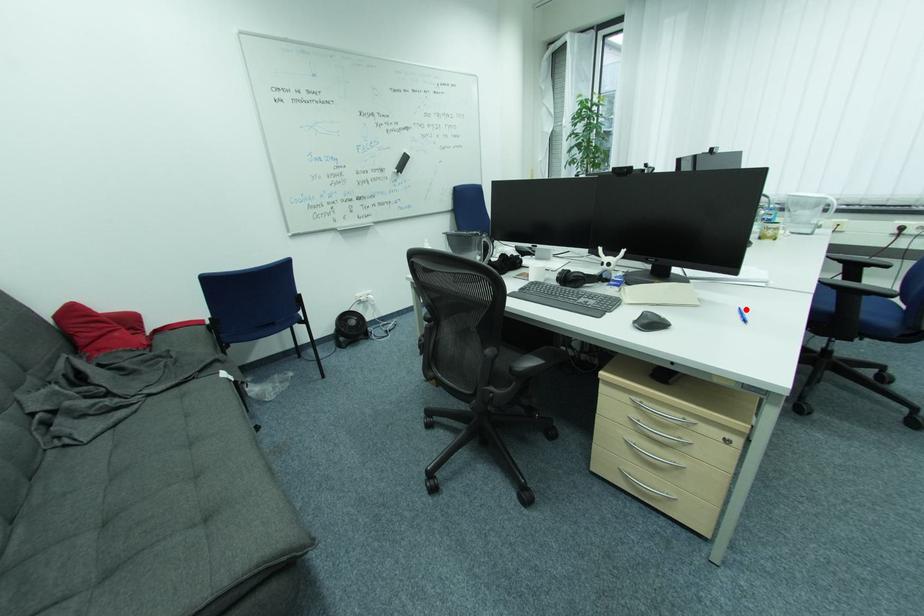
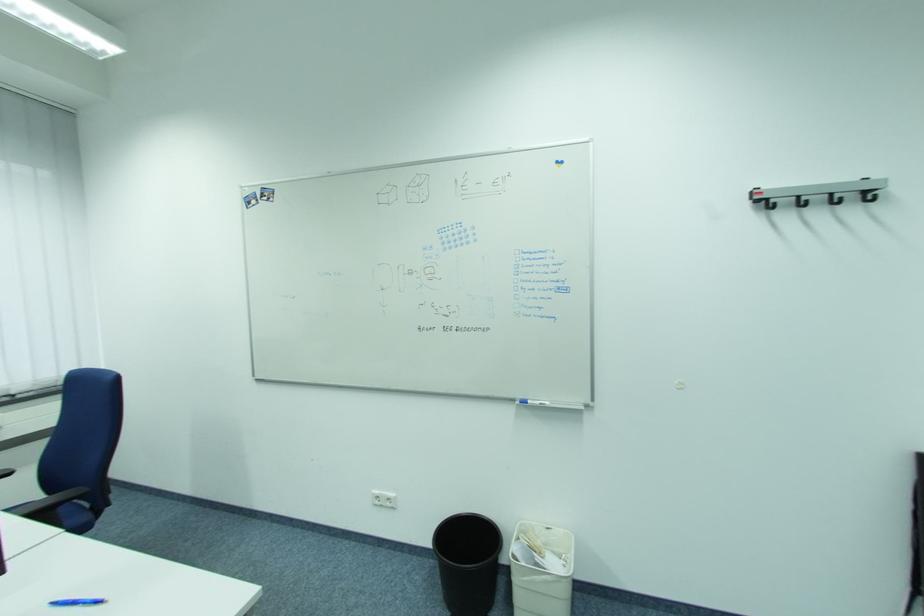
Find the pixel in the second image that matches the highlighted location in the first image.

(57, 605)